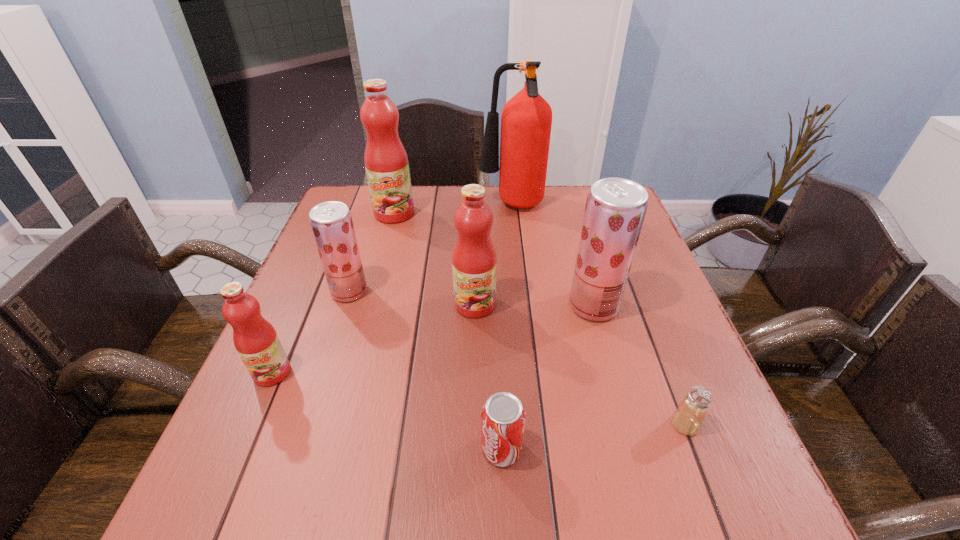
You are a GUI agent. You are given a task and a screenshot of the screen. Output one action in this format:
    pyautogui.click(x=<x>, y=<y>)
    Task: Click on the blank space located on the front label of the leftmost pink fruit juice
    This screenshot has width=960, height=540.
    Given the screenshot: What is the action you would take?
    pyautogui.click(x=247, y=431)

You are a GUI agent. You are given a task and a screenshot of the screen. Output one action in this format:
    pyautogui.click(x=<x>, y=<y>)
    Task: Click on the vacant space located 0.230m on the back of the seventh tallest object
    
    Given the screenshot: What is the action you would take?
    pyautogui.click(x=497, y=333)

In order to click on free spot located on the left of the rightmost object in this screenshot , I will do `click(643, 424)`.

The height and width of the screenshot is (540, 960). What are the coordinates of `fire extinguisher that is positioned at the far edge` in the screenshot? It's located at (526, 120).

Find the location of `fruit juice located in the far edge section of the desktop`. fruit juice located in the far edge section of the desktop is located at coordinates click(386, 162).

Identify the location of fruit juice at the right edge. The width and height of the screenshot is (960, 540). (615, 209).

The height and width of the screenshot is (540, 960). In order to click on saltshaker that is positioned at the right edge in this screenshot , I will do `click(688, 418)`.

Where is `object at the far left corner`? object at the far left corner is located at coordinates (386, 162).

The image size is (960, 540). Find the location of `vacant space at the far edge of the desktop`. vacant space at the far edge of the desktop is located at coordinates (445, 186).

This screenshot has height=540, width=960. Find the location of `free location at the near edge of the desktop`. free location at the near edge of the desktop is located at coordinates (562, 506).